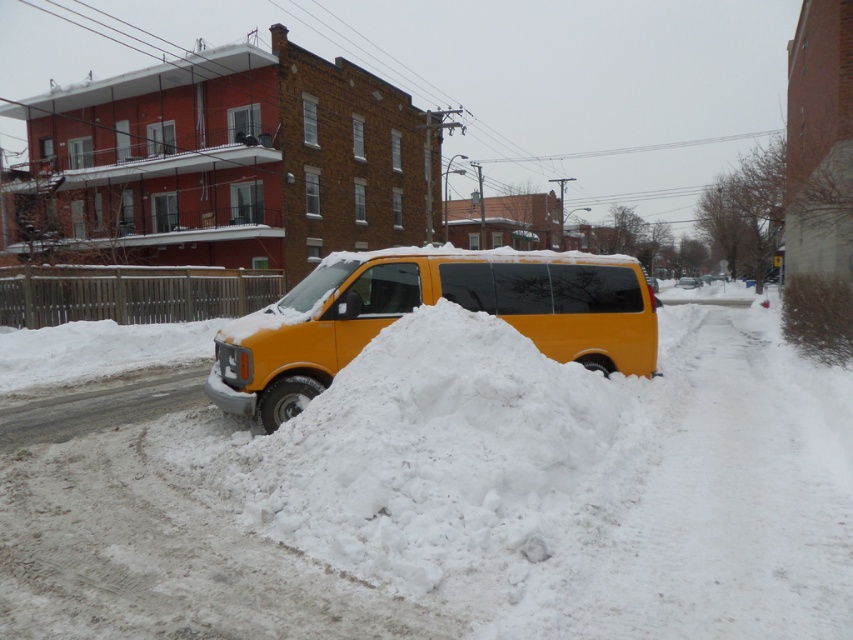
Looking at this image, you are a delivery driver who needs to reach the red brick building with white trim located behind the wooden fence on the left side of the snowy street. Your vehicle is a large truck that requires a minimum clearance of 2 meters to pass under the snowdrift. Based on the coordinates provided, can you determine if the snowy white mound at center will block your path?

The snowy white mound at center is located at point (444, 454). Since the truck requires a minimum clearance of 2 meters to pass under the snowdrift, and the coordinates do not provide information about the height of the snowdrift, it is impossible to determine if the snowy white mound at center will block the path.

You are a delivery driver who needs to navigate through the snowy street. The snowy white mound at center and the yellow matte van at center are in your path. Based on their sizes, which one will you have to maneuver around more carefully?

The snowy white mound at center has a larger width than the yellow matte van at center, so you will need to maneuver around the snowy white mound at center more carefully due to its greater size.